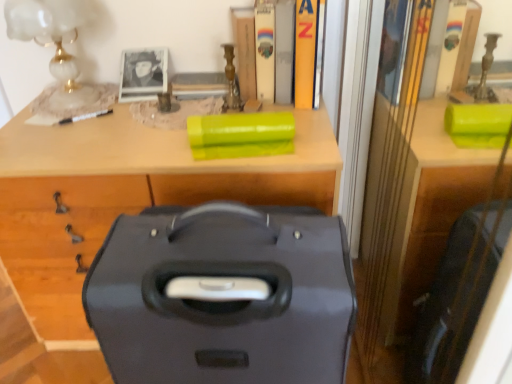
Question: From the image's perspective, is yellow matte book at upper center, the fourth book positioned from the left, under white marble table lamp at upper left?

Choices:
 (A) no
 (B) yes

Answer: (A)

Question: Is yellow matte book at upper center, the first book viewed from the right, positioned with its back to white marble table lamp at upper left?

Choices:
 (A) no
 (B) yes

Answer: (A)

Question: Considering the relative positions of yellow matte book at upper center, the first book viewed from the right, and white marble table lamp at upper left in the image provided, is yellow matte book at upper center, the first book viewed from the right, to the left of white marble table lamp at upper left from the viewer's perspective?

Choices:
 (A) yes
 (B) no

Answer: (B)

Question: Considering the relative sizes of yellow matte book at upper center, the first book viewed from the right, and white marble table lamp at upper left in the image provided, is yellow matte book at upper center, the first book viewed from the right, taller than white marble table lamp at upper left?

Choices:
 (A) no
 (B) yes

Answer: (B)

Question: Is the depth of yellow matte book at upper center, the fourth book positioned from the left, less than that of white marble table lamp at upper left?

Choices:
 (A) no
 (B) yes

Answer: (B)

Question: Can you confirm if yellow matte book at upper center, the first book viewed from the right, is thinner than white marble table lamp at upper left?

Choices:
 (A) yes
 (B) no

Answer: (B)

Question: Is matte black suitcase at center smaller than yellow matte book at upper center, the first book viewed from the right?

Choices:
 (A) no
 (B) yes

Answer: (A)

Question: Is matte black suitcase at center not near yellow matte book at upper center, the fourth book positioned from the left?

Choices:
 (A) no
 (B) yes

Answer: (A)

Question: Is matte black suitcase at center turned away from yellow matte book at upper center, the fourth book positioned from the left?

Choices:
 (A) no
 (B) yes

Answer: (A)

Question: Can you confirm if matte black suitcase at center is taller than yellow matte book at upper center, the first book viewed from the right?

Choices:
 (A) no
 (B) yes

Answer: (B)

Question: Could you tell me if matte black suitcase at center is turned towards yellow matte book at upper center, the first book viewed from the right?

Choices:
 (A) yes
 (B) no

Answer: (B)

Question: Is matte black suitcase at center thinner than yellow matte book at upper center, the first book viewed from the right?

Choices:
 (A) yes
 (B) no

Answer: (B)

Question: Could you tell me if wooden book at upper center, which ranks as the fourth book in right-to-left order, is turned towards matte black suitcase at center?

Choices:
 (A) no
 (B) yes

Answer: (B)